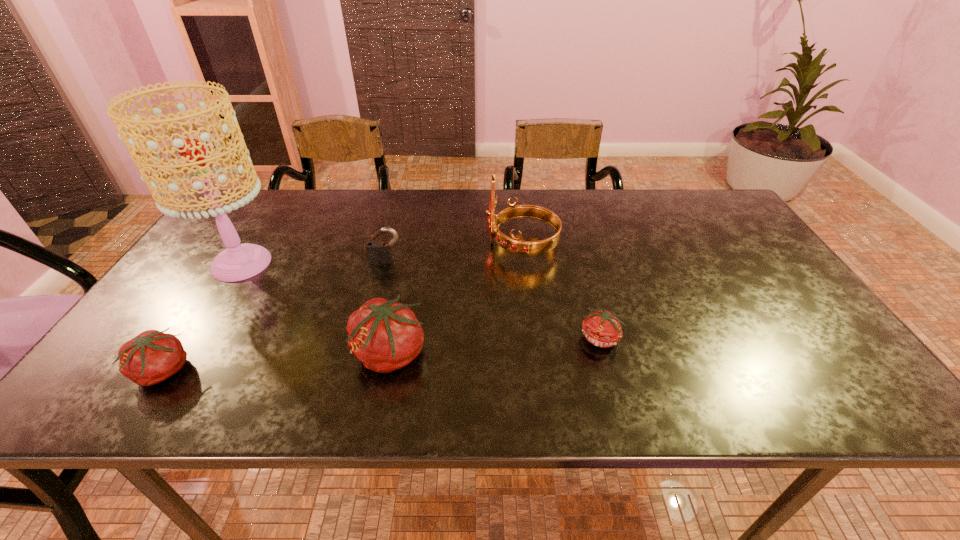
This screenshot has width=960, height=540. Find the location of `object located at the near left corner`. object located at the near left corner is located at coordinates (151, 357).

Where is `free spot at the far edge of the desktop`? free spot at the far edge of the desktop is located at coordinates (646, 215).

The width and height of the screenshot is (960, 540). In order to click on vacant region at the near edge of the desktop in this screenshot , I will do `click(630, 363)`.

Find the location of a particular element. vacant region at the left edge is located at coordinates (204, 307).

Image resolution: width=960 pixels, height=540 pixels. In order to click on vacant space at the right edge of the desktop in this screenshot , I will do `click(804, 311)`.

At what (x,y) coordinates should I click in order to perform the action: click on vacant space at the near right corner of the desktop. Please return your answer as a coordinate pair (x, y). The width and height of the screenshot is (960, 540). Looking at the image, I should click on pyautogui.click(x=787, y=341).

Identify the location of vacant area that lies between the shortest object and the fourth tallest object. Image resolution: width=960 pixels, height=540 pixels. (493, 300).

Identify the location of vacant area that lies between the second tallest object and the shortest tomato. (562, 292).

Locate an element on the screen. empty space that is in between the leftmost tomato and the fifth object from left to right is located at coordinates (342, 308).

Where is `vacant region between the second tomato from right to left and the shortest object`? This screenshot has width=960, height=540. vacant region between the second tomato from right to left and the shortest object is located at coordinates (495, 346).